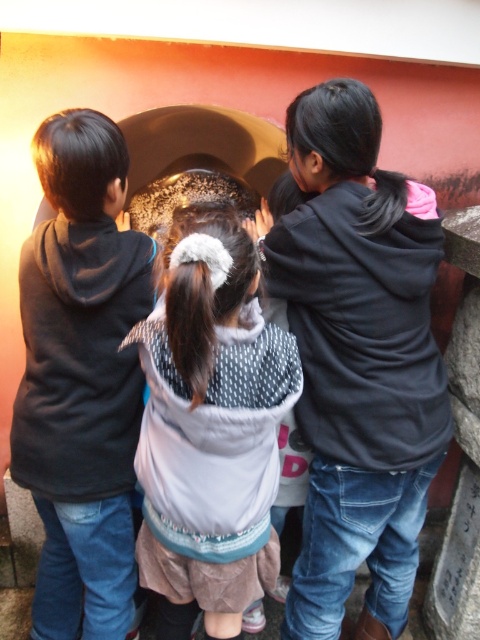
What is the 2D coordinate of the matte black hoodie at left?

The 2D coordinate of the matte black hoodie at left is at point (82, 378).